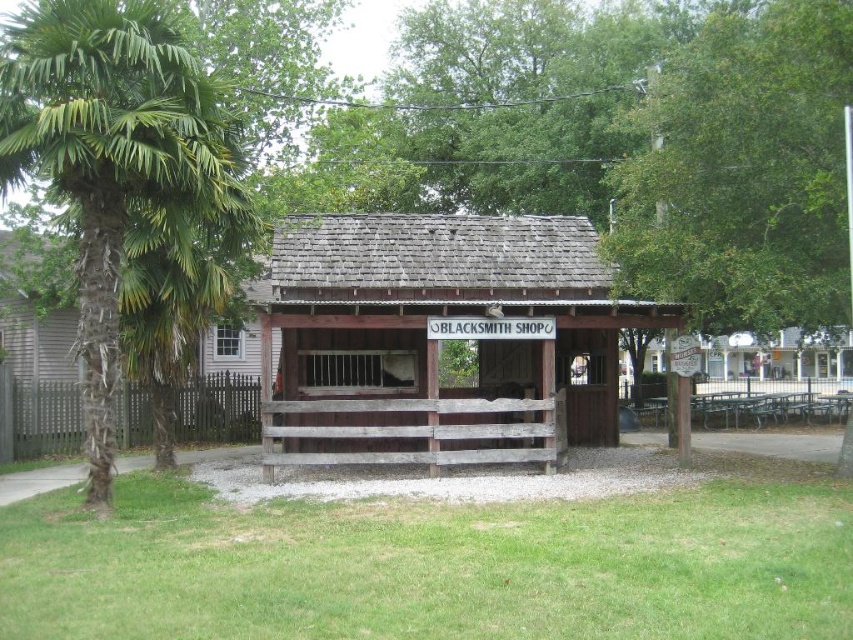
Question: Does weathered wood/blacksmith shop at center appear over green leafy palm tree at left?

Choices:
 (A) no
 (B) yes

Answer: (A)

Question: Is weathered wood/blacksmith shop at center wider than green leafy palm tree at left?

Choices:
 (A) no
 (B) yes

Answer: (A)

Question: Which of the following is the farthest from the observer?

Choices:
 (A) green leafy palm tree at left
 (B) weathered wood/blacksmith shop at center

Answer: (B)

Question: Which point is farther to the camera?

Choices:
 (A) (x=184, y=160)
 (B) (x=463, y=422)

Answer: (B)

Question: Which of the following is the closest to the observer?

Choices:
 (A) green leafy palm tree at left
 (B) weathered wood/blacksmith shop at center

Answer: (A)

Question: Does weathered wood/blacksmith shop at center lie behind green leafy palm tree at left?

Choices:
 (A) yes
 (B) no

Answer: (A)